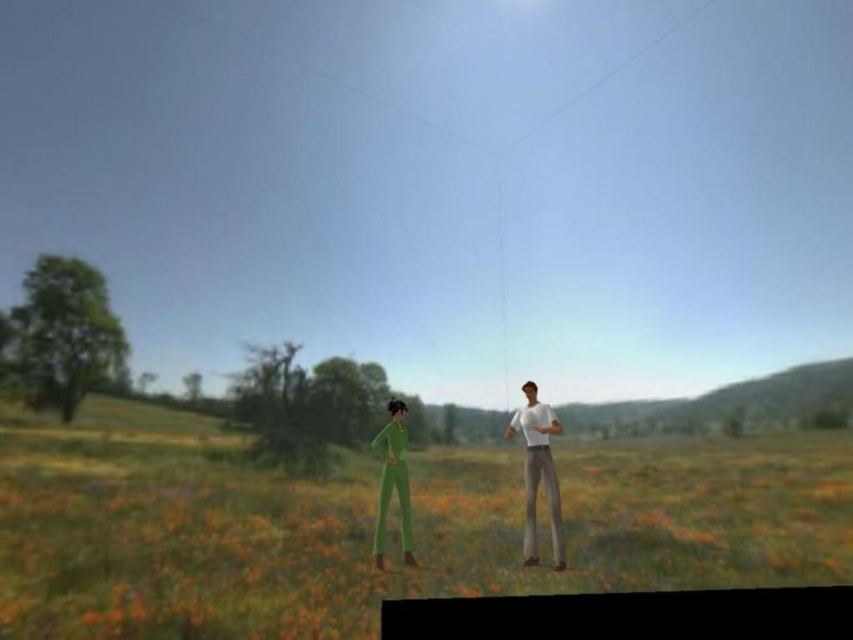
Question: Is green grassy field at center further to camera compared to white matte pants at right?

Choices:
 (A) no
 (B) yes

Answer: (A)

Question: Is white matte pants at right to the left of green matte jumpsuit at lower left from the viewer's perspective?

Choices:
 (A) yes
 (B) no

Answer: (B)

Question: Which point is farther to the camera?

Choices:
 (A) white matte pants at right
 (B) green grassy field at center

Answer: (A)

Question: Can you confirm if white matte pants at right is positioned to the left of green matte jumpsuit at lower left?

Choices:
 (A) yes
 (B) no

Answer: (B)

Question: Which point is farther to the camera?

Choices:
 (A) (846, 518)
 (B) (552, 464)

Answer: (A)

Question: Which object is the closest to the green grassy field at center?

Choices:
 (A) green matte jumpsuit at lower left
 (B) white matte pants at right

Answer: (A)